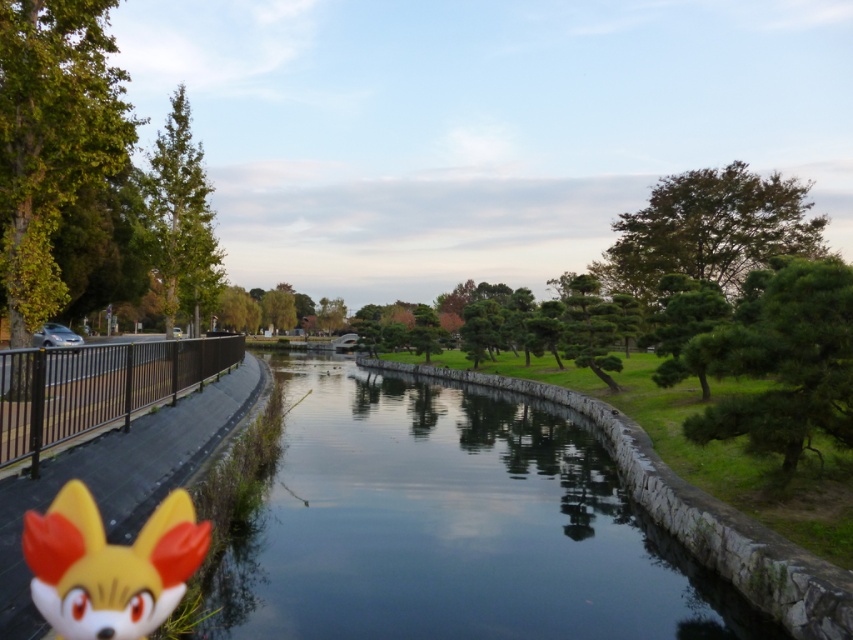
You are standing on the paved pathway next to the smooth stone river at center. If you walk straight ahead along the path, will you eventually reach the black metal railing on the left side of the canal?

Yes, because the black metal railing on the left side of the canal is part of the pathway bordering the smooth stone river at center, so walking straight ahead along the path would lead you toward the railing.

You are a visitor in the park and want to take a photo of the smooth stone river at center and the yellow matte fox head at lower left. Which object should you focus on first if you want to capture both in the same frame without moving the camera?

The yellow matte fox head at lower left should be focused on first since it is positioned to the left of the smooth stone river at center, allowing both to be captured in the same frame by centering the fox head and ensuring the river is to its right within the camera view.

You are a park visitor standing on the paved pathway near the black metal railing. You see the smooth stone river at center and the yellow matte fox head at lower left. Which object is closer to you?

The yellow matte fox head at lower left is closer to you because the smooth stone river at center is further away.